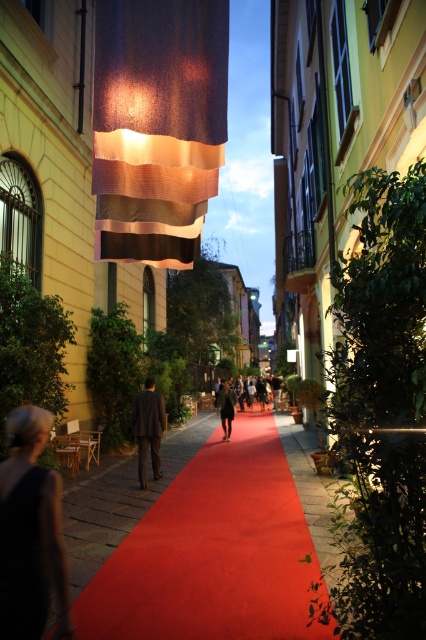
You are a photographer positioned at the end of the alleyway. You want to capture a photo that includes both the smooth red carpet at center and the black fabric dress at lower left. Considering their heights, which object should be placed closer to the camera to ensure both are fully visible in the frame?

The smooth red carpet at center is taller than the black fabric dress at lower left. To ensure both are fully visible, the black fabric dress at lower left should be placed closer to the camera since it is shorter, allowing the taller carpet to still be in frame without being cropped.

You are a photographer standing at the end of the alleyway. You want to capture a photo that includes both the smooth red carpet at center and the black fabric dress at lower left. Considering their sizes, which object should you focus on to ensure both are clearly visible in the frame?

The smooth red carpet at center is bigger than the black fabric dress at lower left. To ensure both are clearly visible, focus on the smooth red carpet at center as it occupies more space and will be easier to frame alongside the smaller black fabric dress at lower left.

You are standing at the camera position in the image. There are two points marked in the scene, point 1 at coordinates point (9, 536) and point 2 at coordinates point (221, 417). Which point is physically closer to you?

Point (9, 536) is closer to the camera than point (221, 417), so point 1 is physically closer to you.